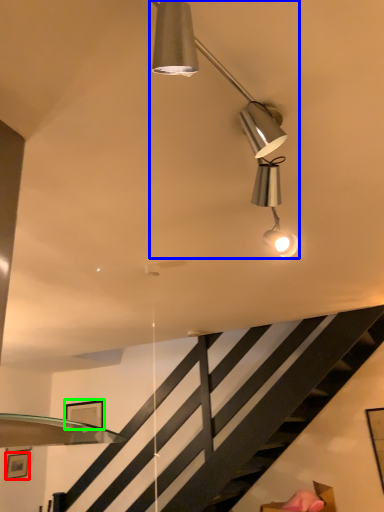
Question: Based on their relative distances, which object is farther from picture frame (highlighted by a red box)? Choose from lamp (highlighted by a blue box) and picture frame (highlighted by a green box).

Choices:
 (A) lamp
 (B) picture frame

Answer: (A)